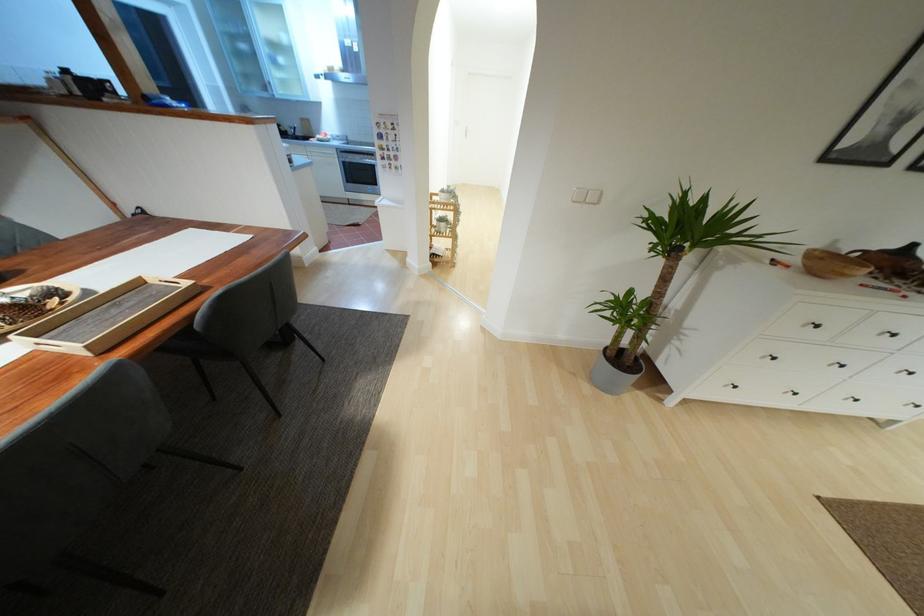
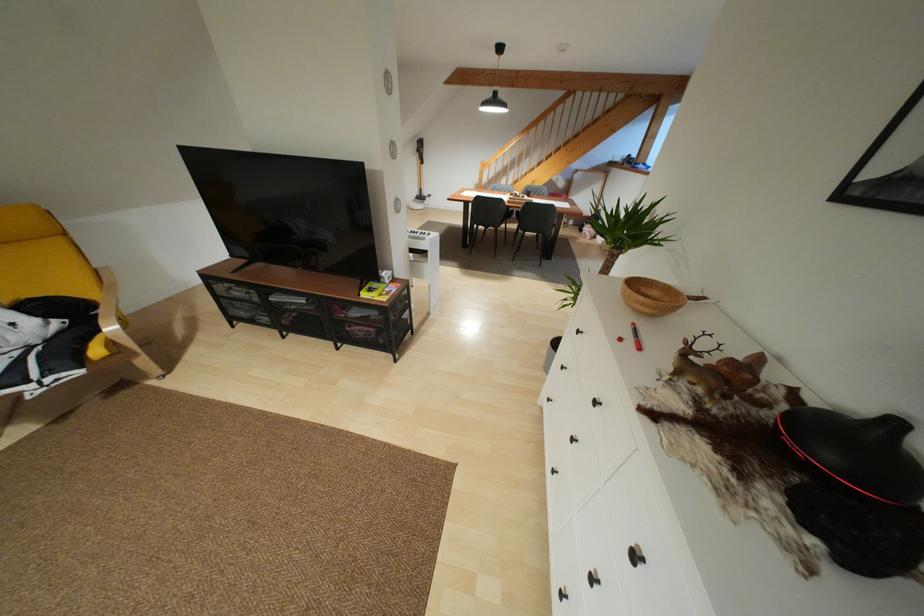
Locate, in the second image, the point that corresponds to pixel 842 366 in the first image.

(572, 439)